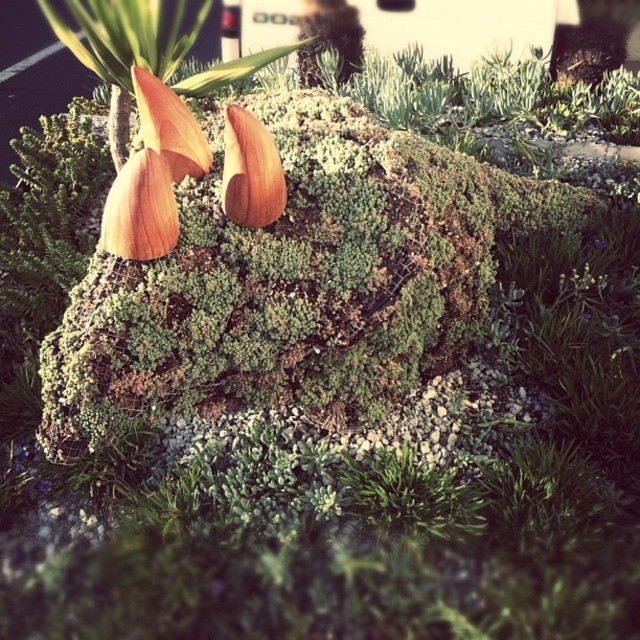
You are a gardener who wants to plant a new flower in the garden. You have two options to choose from the image. The wooden flower at center and the matte orange petal at center. Which one should you choose if you want a larger plant to fill an empty space?

The matte orange petal at center is larger than the wooden flower at center, so you should choose the matte orange petal at center to fill the empty space.

You are a gardener planning to water the wooden flower at center and the wooden petal at center. Which one should you water first if you want to start from the leftmost object?

The wooden flower at center should be watered first because it is positioned on the left side of the wooden petal at center, making it the leftmost object between the two.